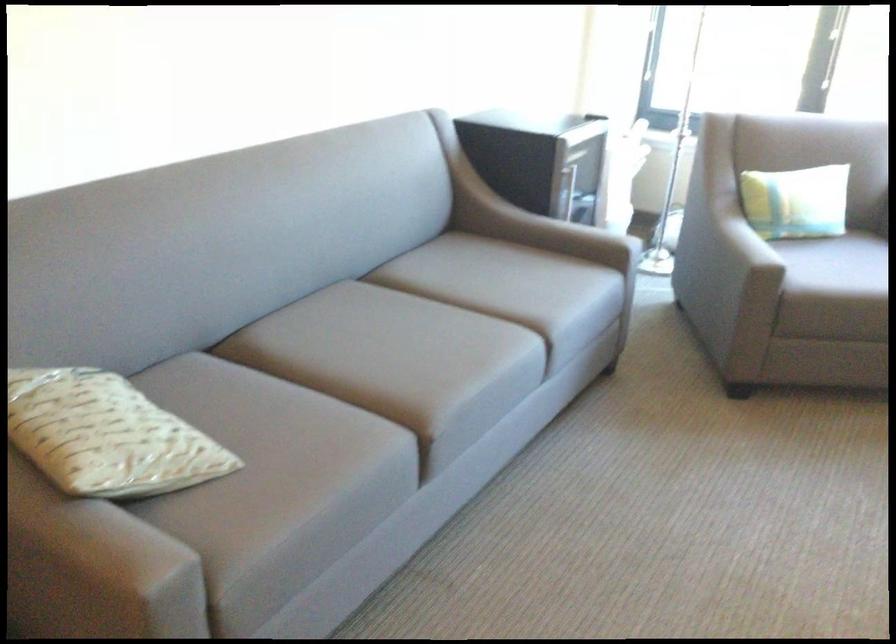
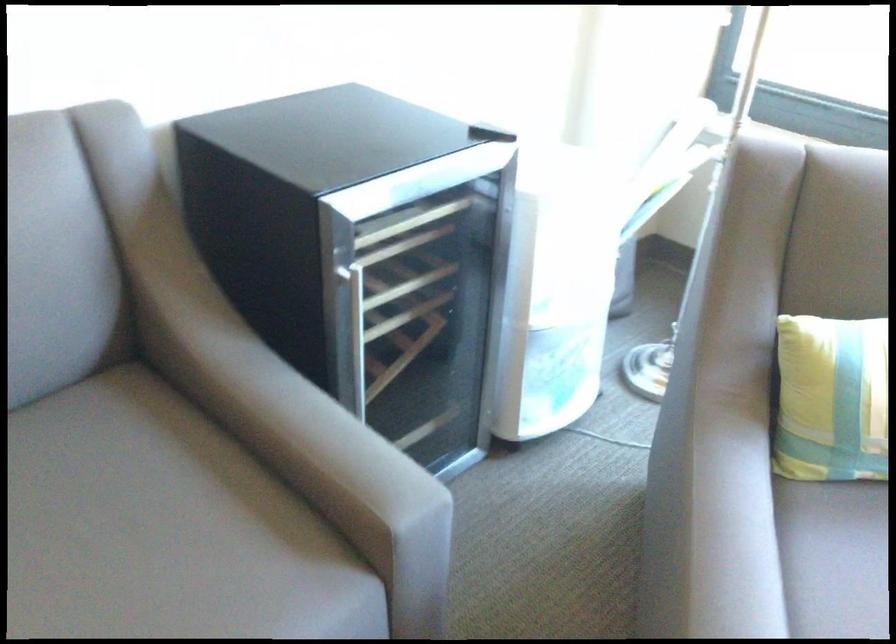
In the second image, find the point that corresponds to point 721,196 in the first image.

(831, 399)